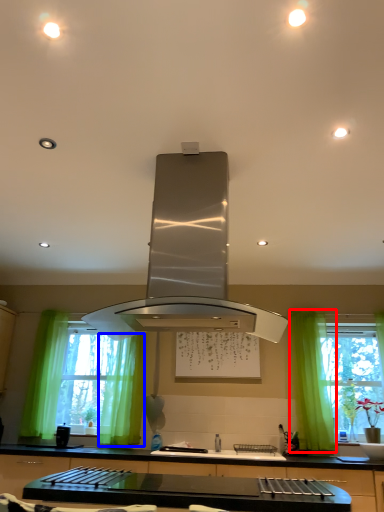
Question: Which object is closer to the camera taking this photo, curtain (highlighted by a red box) or curtain (highlighted by a blue box)?

Choices:
 (A) curtain
 (B) curtain

Answer: (A)